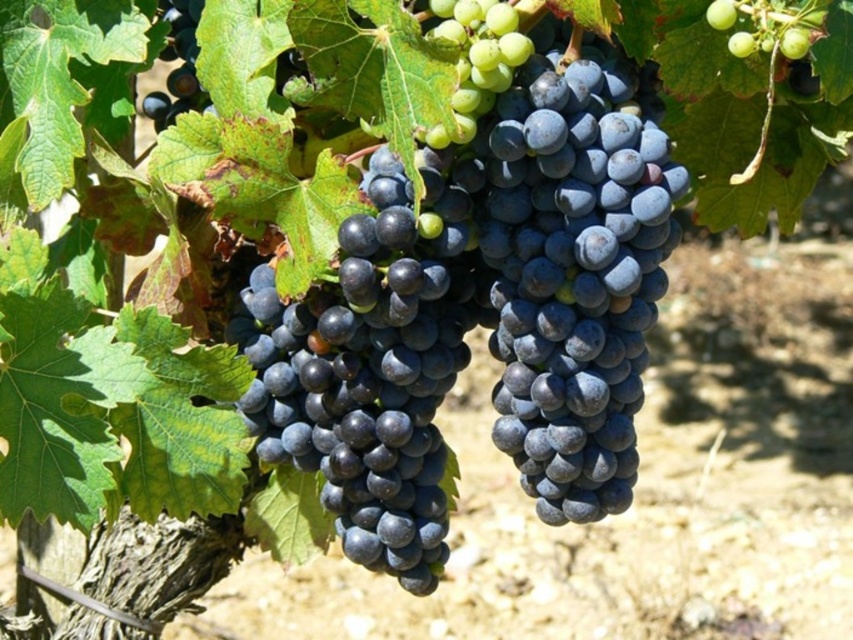
You are a farmer checking the grapes. You notice two grapes, the green matte grape at upper center and the shiny dark blue grape at upper left. Which one has a smaller width?

The green matte grape at upper center has a smaller width than the shiny dark blue grape at upper left according to the description.